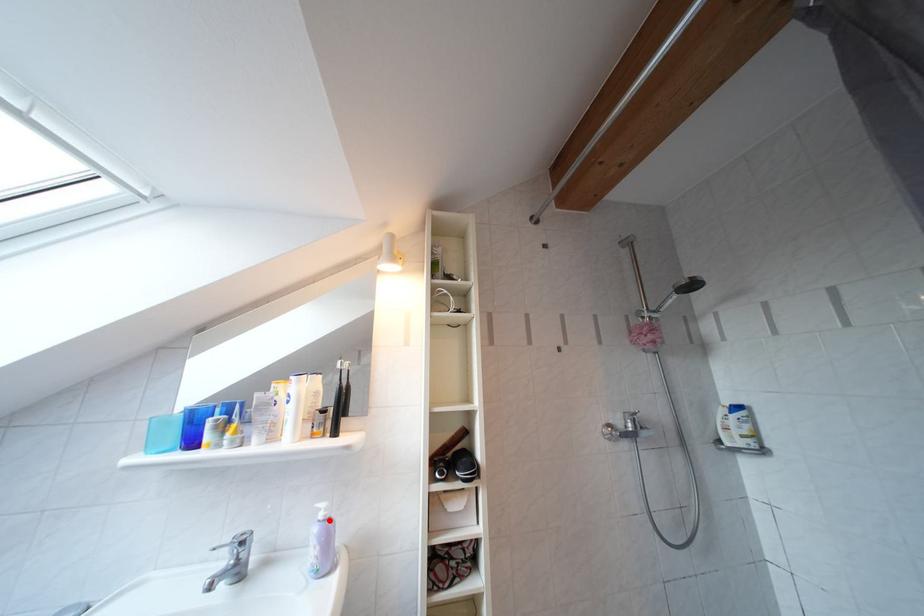
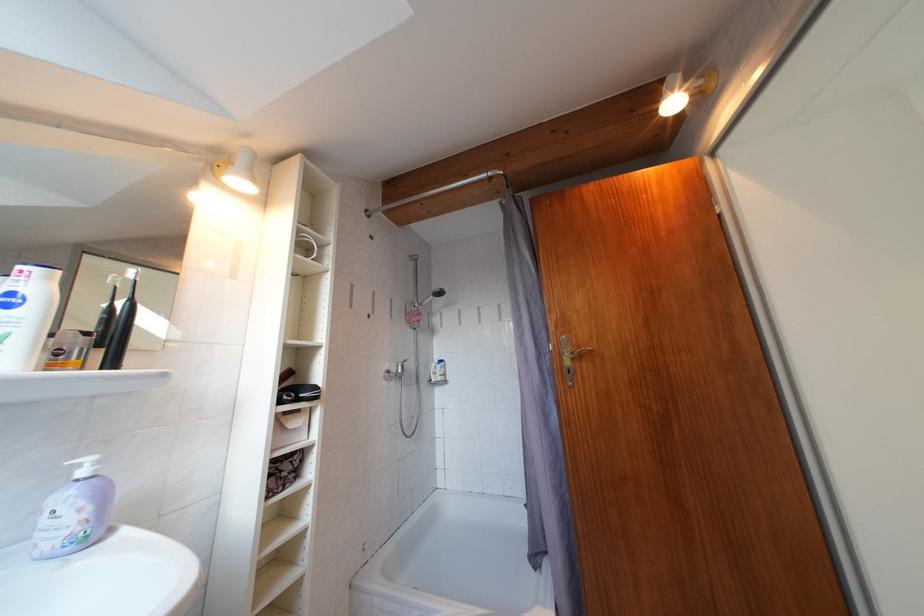
The point at the highlighted location is marked in the first image. Where is the corresponding point in the second image?

(92, 477)